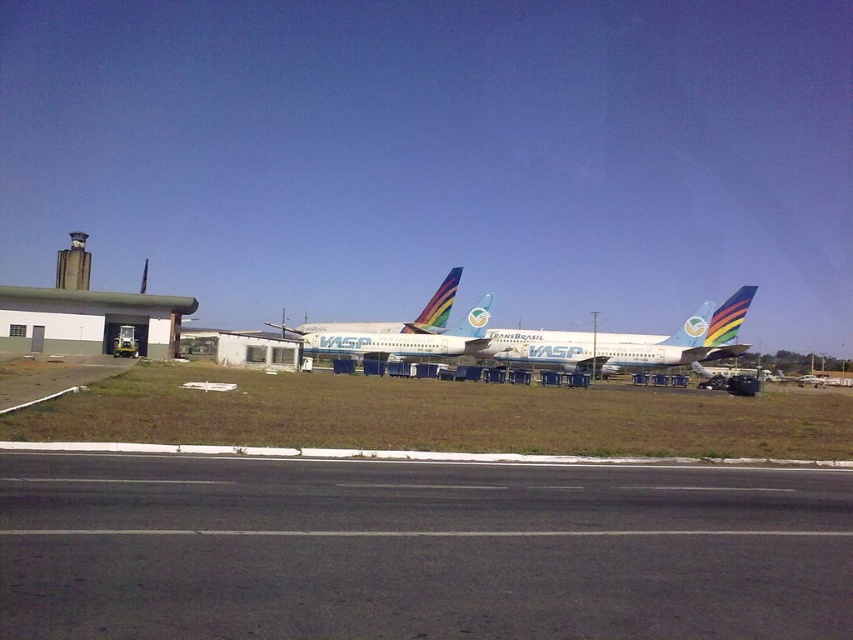
Question: Which of the following is the closest to the observer?

Choices:
 (A) white glossy airplane at center
 (B) black asphalt runway at center

Answer: (B)

Question: Can you confirm if white glossy airliner at center is wider than white glossy airplane at center?

Choices:
 (A) yes
 (B) no

Answer: (B)

Question: Is black asphalt runway at center above white glossy airliner at center?

Choices:
 (A) yes
 (B) no

Answer: (B)

Question: Which is nearer to the white glossy airplane at center?

Choices:
 (A) white glossy airliner at center
 (B) black asphalt runway at center

Answer: (A)

Question: Observing the image, what is the correct spatial positioning of black asphalt runway at center in reference to white glossy airplane at center?

Choices:
 (A) above
 (B) below

Answer: (B)

Question: Which object is the closest to the black asphalt runway at center?

Choices:
 (A) white glossy airplane at center
 (B) white glossy airliner at center

Answer: (B)